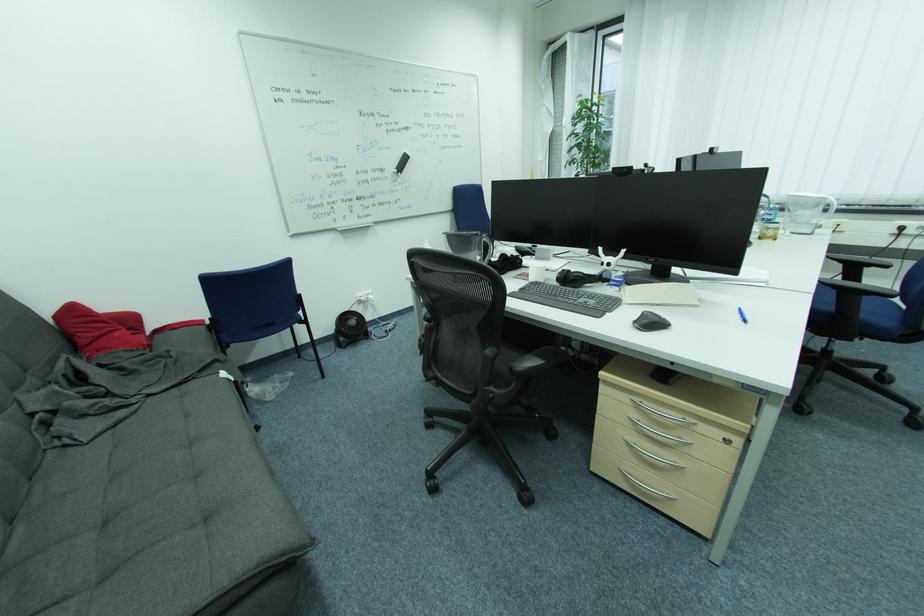
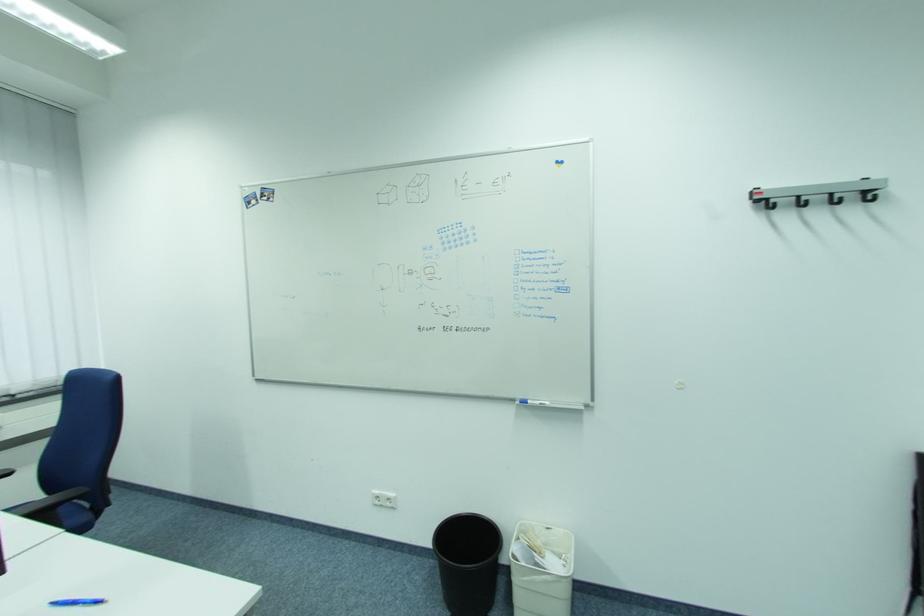
The point at [746,310] is marked in the first image. Where is the corresponding point in the second image?

(57, 605)